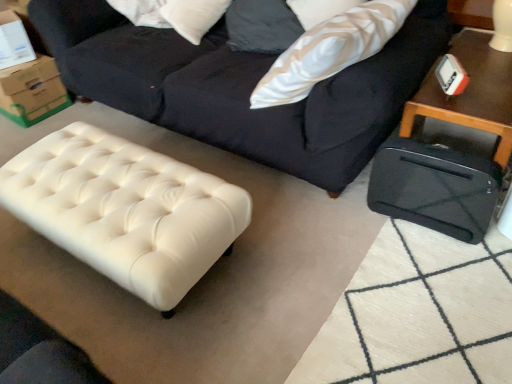
Question: Is white leather ottoman at lower left, arranged as the second table when viewed from the right, in front of or behind black plastic suitcase at right, arranged as the second table when viewed from the left, in the image?

Choices:
 (A) behind
 (B) front

Answer: (B)

Question: Considering the relative positions of white leather ottoman at lower left, marked as the 1th table in a left-to-right arrangement, and black plastic suitcase at right, the 1th table when ordered from right to left, in the image provided, is white leather ottoman at lower left, marked as the 1th table in a left-to-right arrangement, to the left or to the right of black plastic suitcase at right, the 1th table when ordered from right to left,?

Choices:
 (A) left
 (B) right

Answer: (A)

Question: Which object is positioned farthest from the white leather ottoman at lower left, arranged as the second table when viewed from the right?

Choices:
 (A) white textured pillow at upper right
 (B) black plastic suitcase at right, the 1th table when ordered from right to left
 (C) dark blue fabric studio couch at upper center
 (D) green cardboard box at upper left

Answer: (D)

Question: Based on their relative distances, which object is nearer to the dark blue fabric studio couch at upper center?

Choices:
 (A) white textured pillow at upper right
 (B) white leather ottoman at lower left, marked as the 1th table in a left-to-right arrangement
 (C) green cardboard box at upper left
 (D) black plastic suitcase at right, arranged as the second table when viewed from the left

Answer: (A)